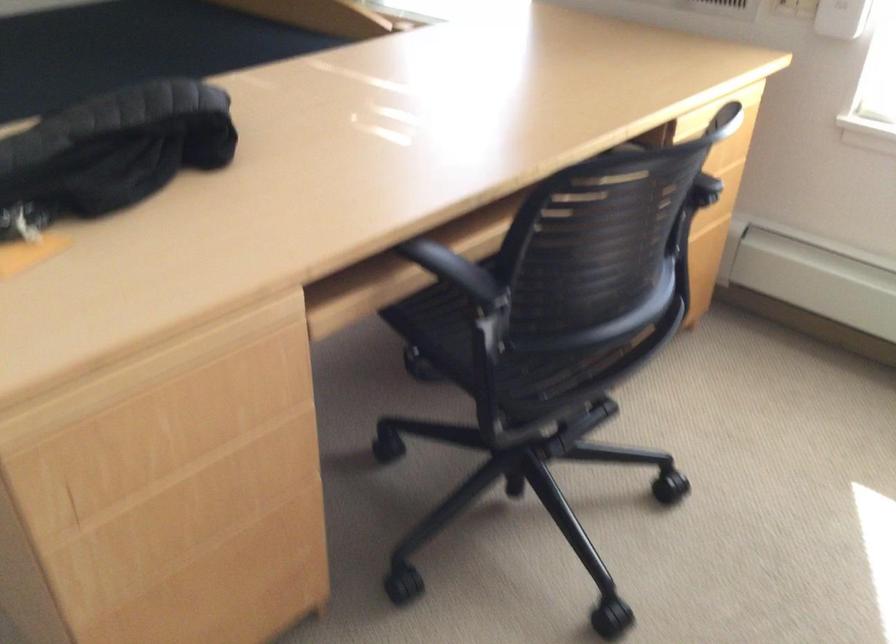
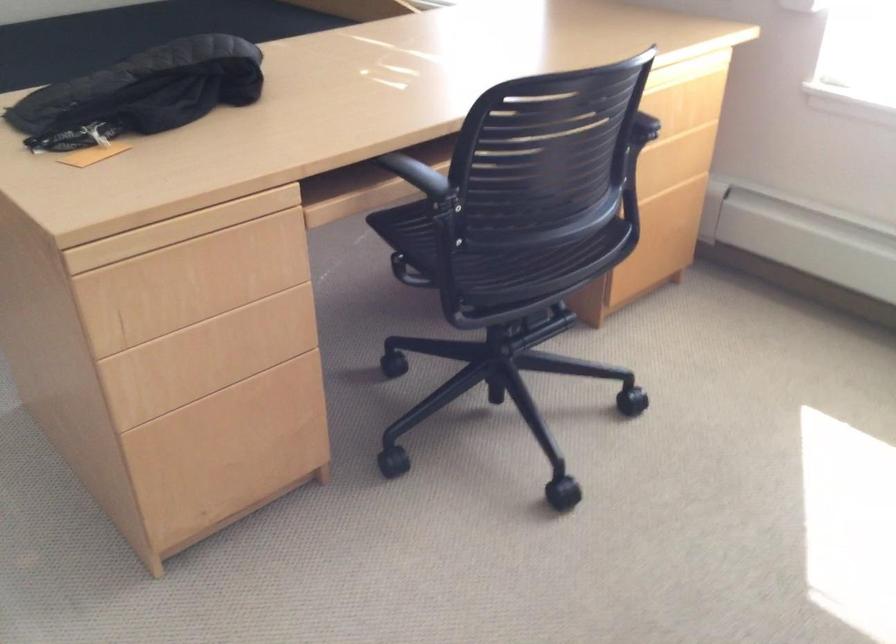
In the second image, find the point that corresponds to [158,361] in the first image.

(179, 229)